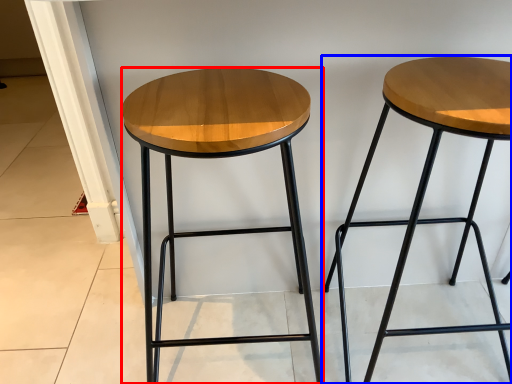
Question: Which point is further to the camera, stool (highlighted by a red box) or stool (highlighted by a blue box)?

Choices:
 (A) stool
 (B) stool

Answer: (B)